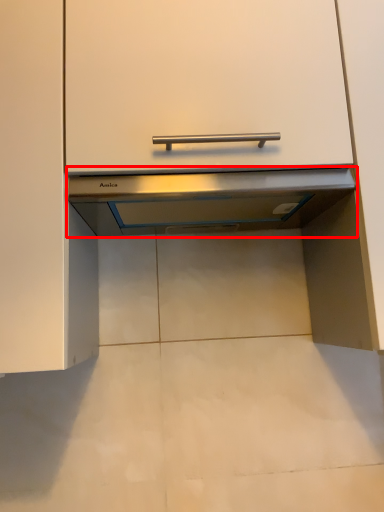
Question: Considering the relative positions of exhaust hood (annotated by the red box) and cabinetry in the image provided, where is exhaust hood (annotated by the red box) located with respect to the staircase?

Choices:
 (A) right
 (B) left

Answer: (A)